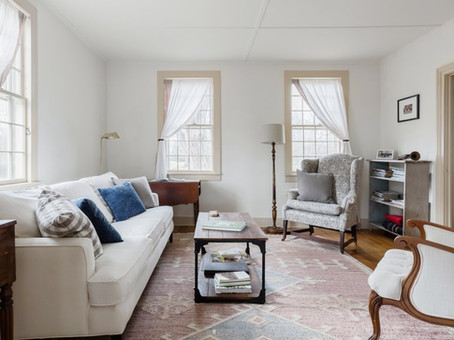
Where is `door frame`? door frame is located at coordinates click(445, 166).